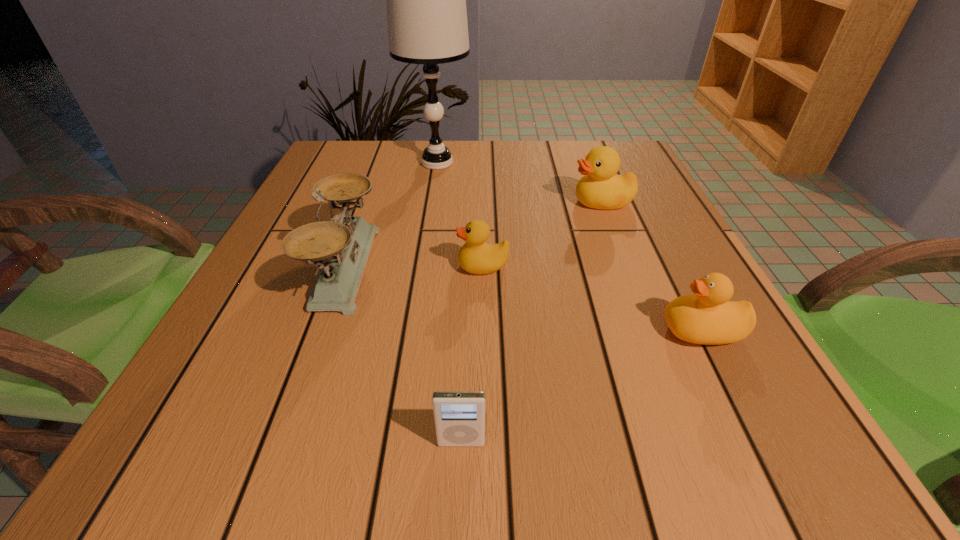
This screenshot has width=960, height=540. Identify the location of vacant region that satisfies the following two spatial constraints: 1. at the beak of the leftmost duck; 2. on the front-facing side of the nearest object. (485, 443).